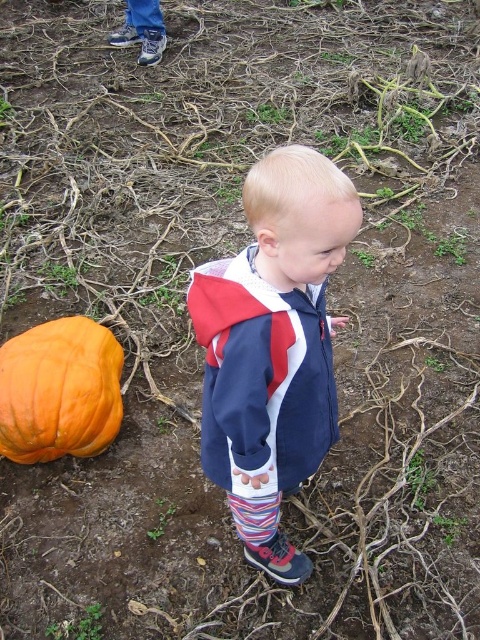
This screenshot has height=640, width=480. What do you see at coordinates (273, 346) in the screenshot?
I see `navy blue jacket at center` at bounding box center [273, 346].

Can you confirm if navy blue jacket at center is taller than orange matte pumpkin at lower left?

Yes, navy blue jacket at center is taller than orange matte pumpkin at lower left.

This screenshot has height=640, width=480. I want to click on navy blue jacket at center, so click(273, 346).

I want to click on navy blue jacket at center, so click(x=273, y=346).